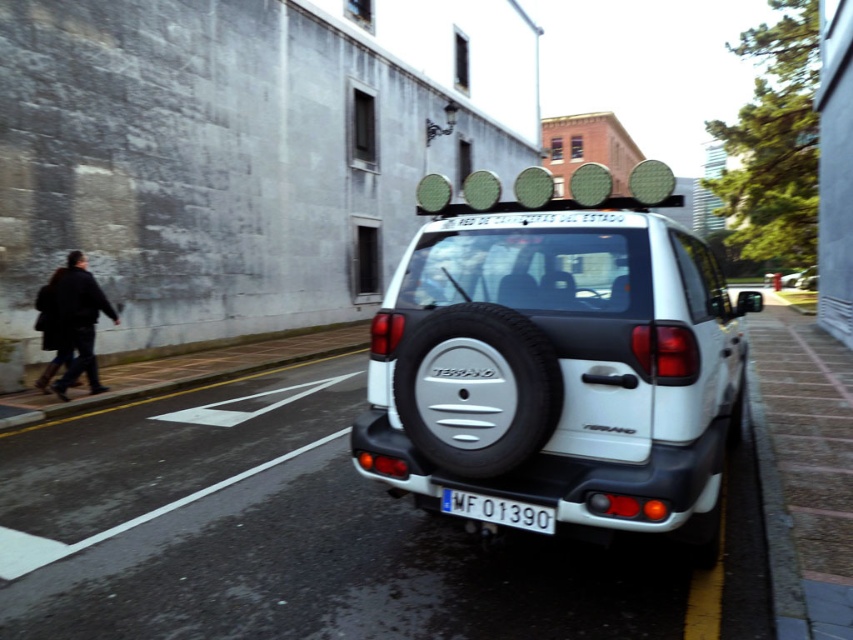
Does dark wool coat at left appear on the right side of white plastic license plate at center?

→ Incorrect, dark wool coat at left is not on the right side of white plastic license plate at center.

Which is in front, point (86, 372) or point (469, 513)?

Point (469, 513)

Where is `dark wool coat at left`? dark wool coat at left is located at coordinates (78, 320).

In order to click on dark wool coat at left in this screenshot , I will do `click(78, 320)`.

Who is shorter, white matte minivan at center or white plastic license plate at center?

With less height is white plastic license plate at center.

Can you confirm if white matte minivan at center is taller than white plastic license plate at center?

Correct, white matte minivan at center is much taller as white plastic license plate at center.

The image size is (853, 640). Find the location of `white matte minivan at center`. white matte minivan at center is located at coordinates (558, 362).

Does white matte minivan at center have a greater height compared to dark wool coat at left?

Yes, white matte minivan at center is taller than dark wool coat at left.

Is white matte minivan at center smaller than dark wool coat at left?

Incorrect, white matte minivan at center is not smaller in size than dark wool coat at left.

Which is in front, point (637, 440) or point (61, 301)?

Point (637, 440) is in front.

Where is `white matte minivan at center`? white matte minivan at center is located at coordinates (558, 362).